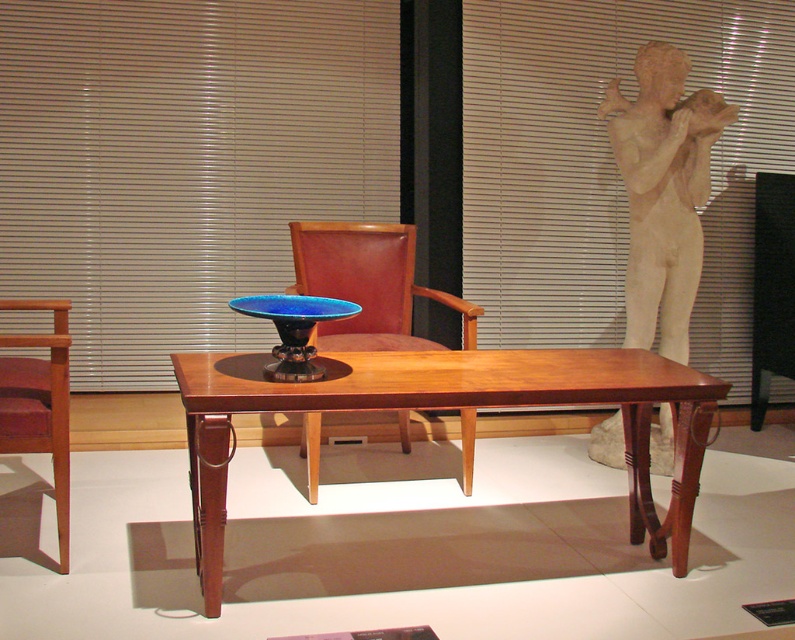
You are a delivery person trying to move a new sofa that is 30 inches wide into the room. The sofa needs to pass between the mahogany wood table at center and the brown leather chair at center. Can the sofa fit through the space between them?

The distance between the mahogany wood table at center and the brown leather chair at center is 27.11 inches. Since the sofa is 30 inches wide, it cannot fit through the space as the available width is narrower than the sofa.

You are an art curator planning to move the blue glass bowl at center closer to the mahogany wood chair at left. Based on their current positions, which object is closer to you and would require less movement to adjust?

The mahogany wood chair at left is closer to you than the blue glass bowl at center, so moving the blue glass bowl at center closer to it would require adjusting the bowl since the chair is already nearer.

You are standing in the gallery and want to sit down on the brown leather chair at center. Where should you walk towards relative to the mahogany wood table at center?

The mahogany wood table at center is located below the brown leather chair at center, so you should walk towards the area above the mahogany wood table at center to reach the brown leather chair at center.